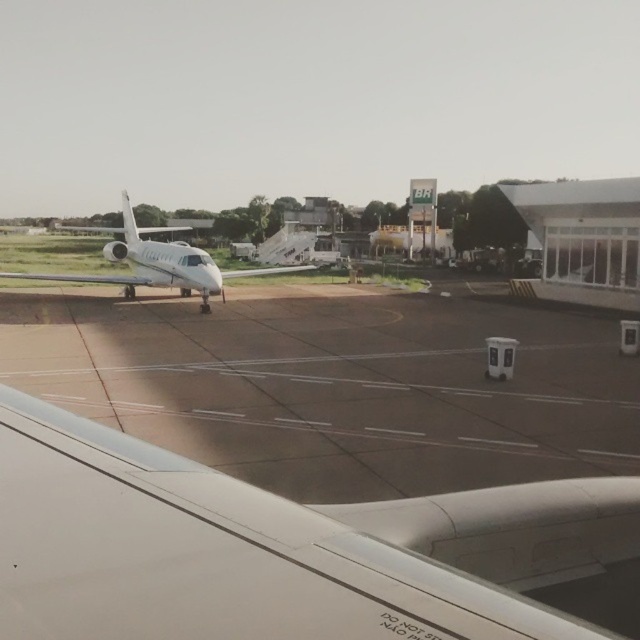
Is white matte wing at upper left positioned at the back of clear glass airplane window at center?

No.

Is white matte wing at upper left thinner than clear glass airplane window at center?

No, white matte wing at upper left is not thinner than clear glass airplane window at center.

Locate an element on the screen. This screenshot has width=640, height=640. white matte wing at upper left is located at coordinates (275, 547).

Does dark gray asphalt at center have a smaller size compared to clear glass airplane window at center?

Actually, dark gray asphalt at center might be larger than clear glass airplane window at center.

What are the coordinates of `dark gray asphalt at center` in the screenshot? It's located at (337, 387).

Where is `dark gray asphalt at center`? dark gray asphalt at center is located at coordinates (337, 387).

Is dark gray asphalt at center below white glossy airplane at left?

Indeed, dark gray asphalt at center is positioned under white glossy airplane at left.

Can you confirm if dark gray asphalt at center is thinner than white glossy airplane at left?

Correct, dark gray asphalt at center's width is less than white glossy airplane at left's.

Find the location of a particular element. Image resolution: width=640 pixels, height=640 pixels. dark gray asphalt at center is located at coordinates (337, 387).